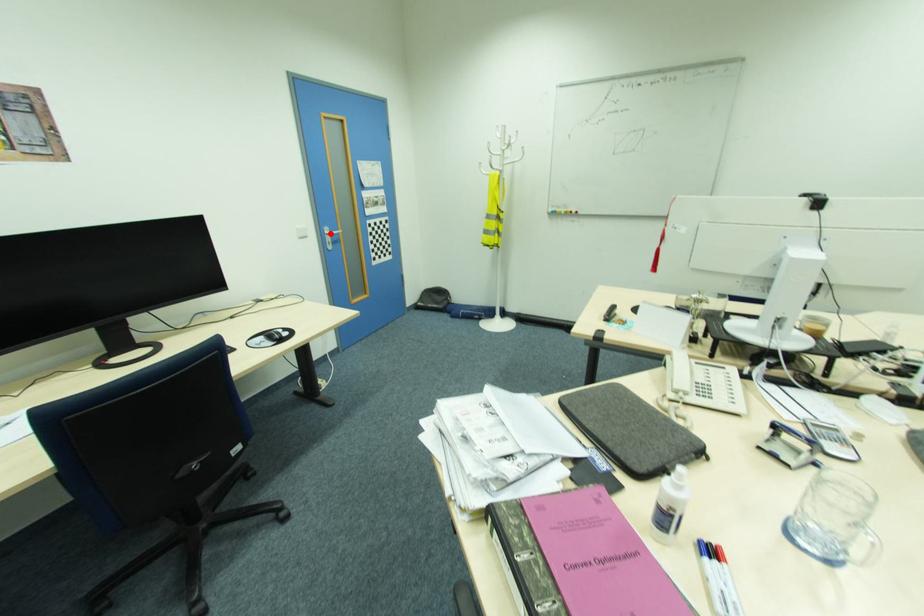
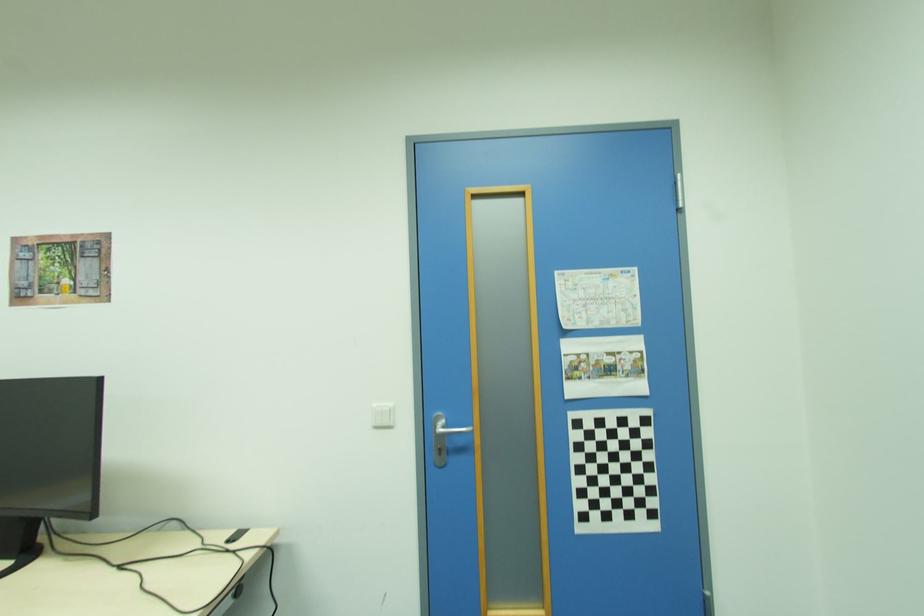
The point at the highlighted location is marked in the first image. Where is the corresponding point in the second image?

(439, 429)